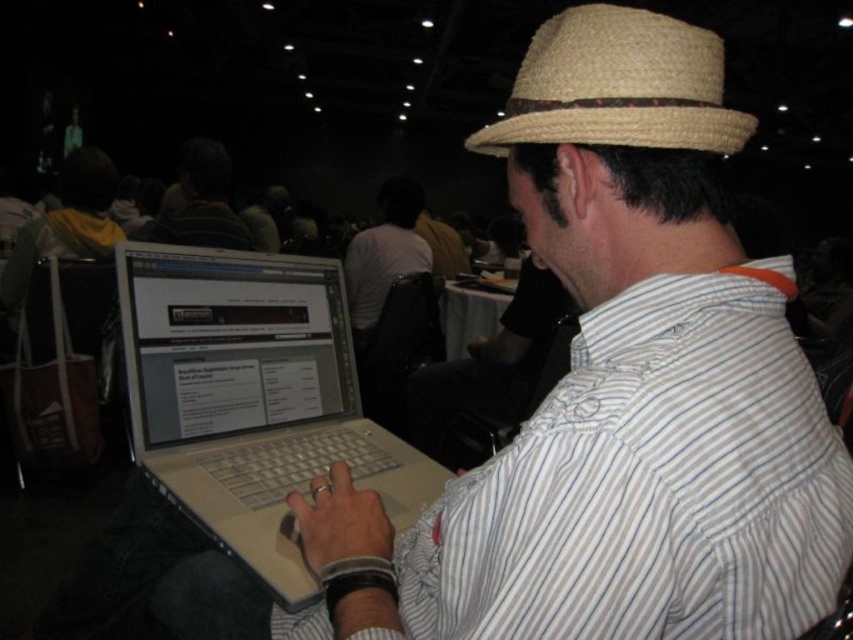
Question: Does white striped shirt at center appear on the left side of straw hat at upper center?

Choices:
 (A) yes
 (B) no

Answer: (A)

Question: Is white striped shirt at center behind dark brown leather jacket at upper center?

Choices:
 (A) no
 (B) yes

Answer: (A)

Question: Is white striped shirt at center above straw hat at upper center?

Choices:
 (A) yes
 (B) no

Answer: (B)

Question: Estimate the real-world distances between objects in this image. Which object is farther from the silver metallic laptop at center?

Choices:
 (A) straw hat at upper center
 (B) dark brown leather jacket at upper center
 (C) white striped shirt at center

Answer: (B)

Question: Based on their relative distances, which object is nearer to the white striped shirt at center?

Choices:
 (A) straw hat at upper center
 (B) dark brown leather jacket at upper center

Answer: (A)

Question: Which object is positioned closest to the silver metallic laptop at center?

Choices:
 (A) white striped shirt at center
 (B) dark brown leather jacket at upper center

Answer: (A)